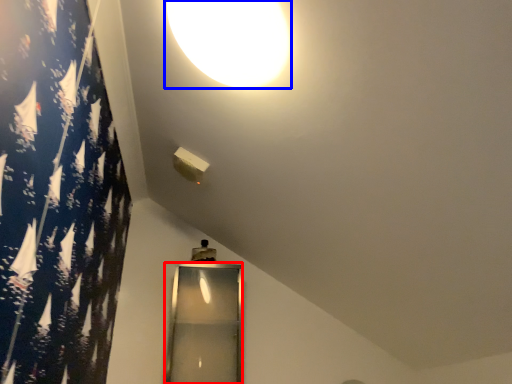
Question: Which object appears farthest to the camera in this image, glass door (highlighted by a red box) or lamp (highlighted by a blue box)?

Choices:
 (A) glass door
 (B) lamp

Answer: (A)